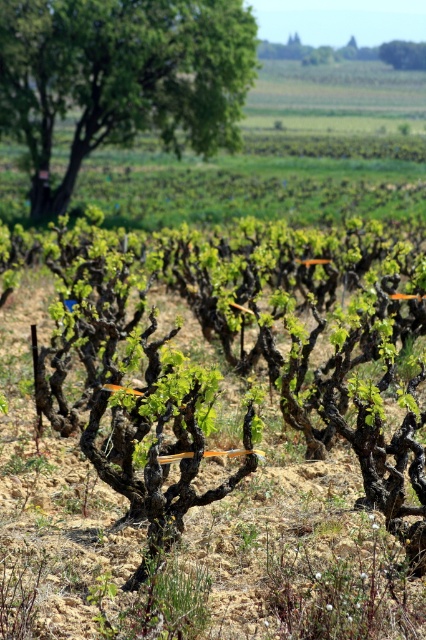
Question: Is green leafy tree at upper left in front of green leafy tree at upper center?

Choices:
 (A) yes
 (B) no

Answer: (A)

Question: In this image, where is green leafy tree at upper left located relative to green leafy tree at upper center?

Choices:
 (A) below
 (B) above

Answer: (A)

Question: Which point is closer to the camera?

Choices:
 (A) green leafy tree at upper left
 (B) green leafy tree at upper center

Answer: (A)

Question: Observing the image, what is the correct spatial positioning of green leafy tree at upper left in reference to green leafy tree at upper center?

Choices:
 (A) left
 (B) right

Answer: (A)

Question: Which object appears closest to the camera in this image?

Choices:
 (A) green leafy tree at upper center
 (B) green leafy tree at upper left

Answer: (B)